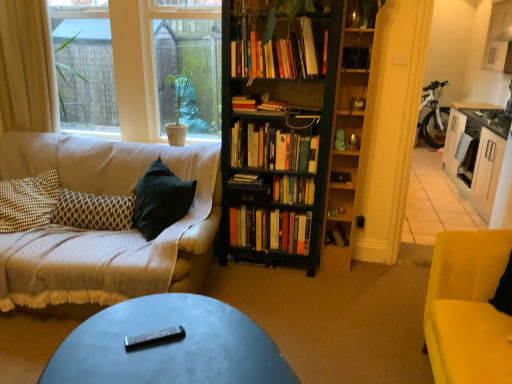
This screenshot has height=384, width=512. I want to click on unoccupied area in front of black wooden bookcase at center, so click(x=285, y=294).